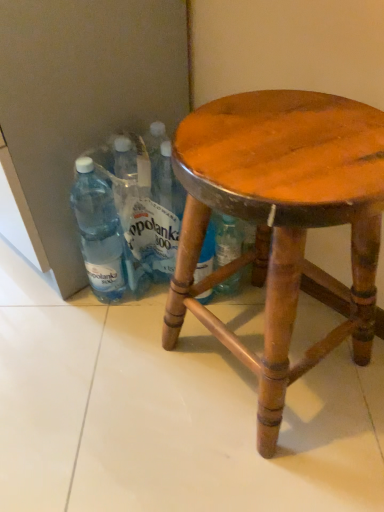
Question: Does transparent plastic bottle at left have a greater width compared to wooden stool at center?

Choices:
 (A) yes
 (B) no

Answer: (B)

Question: Does transparent plastic bottle at left have a lesser height compared to wooden stool at center?

Choices:
 (A) yes
 (B) no

Answer: (A)

Question: Would you say transparent plastic bottle at left contains wooden stool at center?

Choices:
 (A) no
 (B) yes

Answer: (A)

Question: From a real-world perspective, is transparent plastic bottle at left under wooden stool at center?

Choices:
 (A) no
 (B) yes

Answer: (B)

Question: Can you confirm if transparent plastic bottle at left is positioned to the right of wooden stool at center?

Choices:
 (A) yes
 (B) no

Answer: (B)

Question: Based on their sizes in the image, would you say wooden stool at center is bigger or smaller than transparent plastic bottle at left?

Choices:
 (A) big
 (B) small

Answer: (A)

Question: Is wooden stool at center situated inside transparent plastic bottle at left or outside?

Choices:
 (A) outside
 (B) inside

Answer: (A)

Question: From the image's perspective, is wooden stool at center positioned above or below transparent plastic bottle at left?

Choices:
 (A) below
 (B) above

Answer: (A)

Question: Considering the relative positions of wooden stool at center and transparent plastic bottle at left in the image provided, is wooden stool at center to the left or to the right of transparent plastic bottle at left?

Choices:
 (A) right
 (B) left

Answer: (A)

Question: Considering the positions of transparent plastic bottle at left and transparent plastic bottles at lower left in the image, is transparent plastic bottle at left wider or thinner than transparent plastic bottles at lower left?

Choices:
 (A) wide
 (B) thin

Answer: (A)

Question: Is transparent plastic bottle at left inside the boundaries of transparent plastic bottles at lower left, or outside?

Choices:
 (A) outside
 (B) inside

Answer: (A)

Question: In terms of height, does transparent plastic bottle at left look taller or shorter compared to transparent plastic bottles at lower left?

Choices:
 (A) tall
 (B) short

Answer: (B)

Question: Does point (107, 188) appear closer or farther from the camera than point (114, 266)?

Choices:
 (A) closer
 (B) farther

Answer: (A)

Question: Would you say transparent plastic bottle at left is to the left or to the right of wooden stool at center in the picture?

Choices:
 (A) left
 (B) right

Answer: (A)

Question: Is point (117, 230) positioned closer to the camera than point (231, 160)?

Choices:
 (A) farther
 (B) closer

Answer: (A)